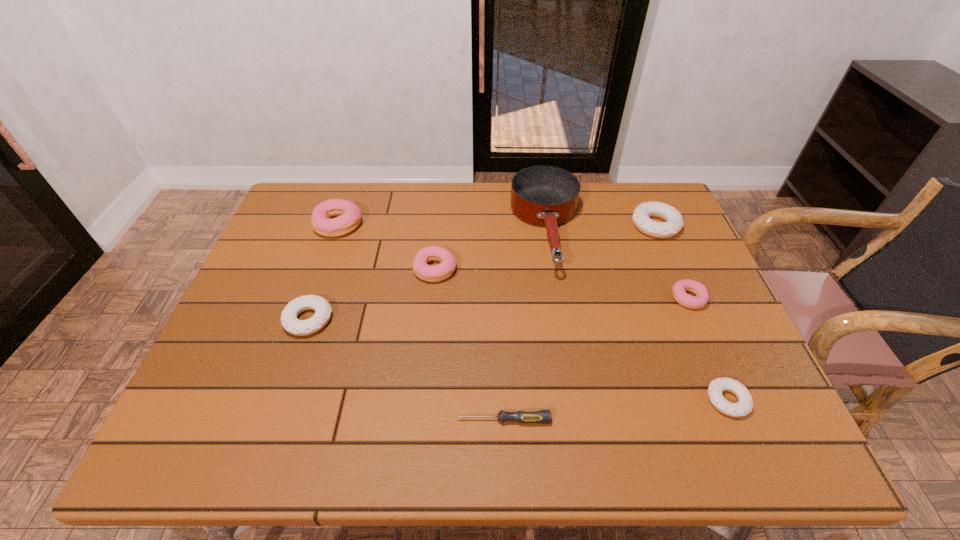
Where is `vacant area that lies between the screwdriver and the shortest doughnut`? This screenshot has height=540, width=960. vacant area that lies between the screwdriver and the shortest doughnut is located at coordinates (615, 410).

This screenshot has width=960, height=540. In order to click on free spot between the biggest white doughnut and the smallest pink doughnut in this screenshot , I will do `click(672, 262)`.

Find the location of a particular element. This screenshot has width=960, height=540. free space between the nearest white doughnut and the leftmost white doughnut is located at coordinates (518, 360).

This screenshot has width=960, height=540. What are the coordinates of `empty space between the third doughnut from left to right and the tallest object` in the screenshot? It's located at (491, 249).

Locate an element on the screen. This screenshot has width=960, height=540. free space between the second farthest white doughnut and the second tallest object is located at coordinates (324, 272).

What are the coordinates of `free space between the farthest pink doughnut and the screwdriver` in the screenshot? It's located at (420, 322).

Identify the location of free space between the rightmost pink doughnut and the tallest object. Image resolution: width=960 pixels, height=540 pixels. (617, 265).

Locate an element on the screen. The height and width of the screenshot is (540, 960). blank region between the screwdriver and the smallest white doughnut is located at coordinates (615, 410).

Identify the location of object that is the third closest to the screwdriver. This screenshot has height=540, width=960. (290, 322).

Select which object appears as the second closest to the second farthest white doughnut. Please provide its 2D coordinates. Your answer should be formatted as a tuple, i.e. [(x, y)], where the tuple contains the x and y coordinates of a point satisfying the conditions above.

[(349, 215)]